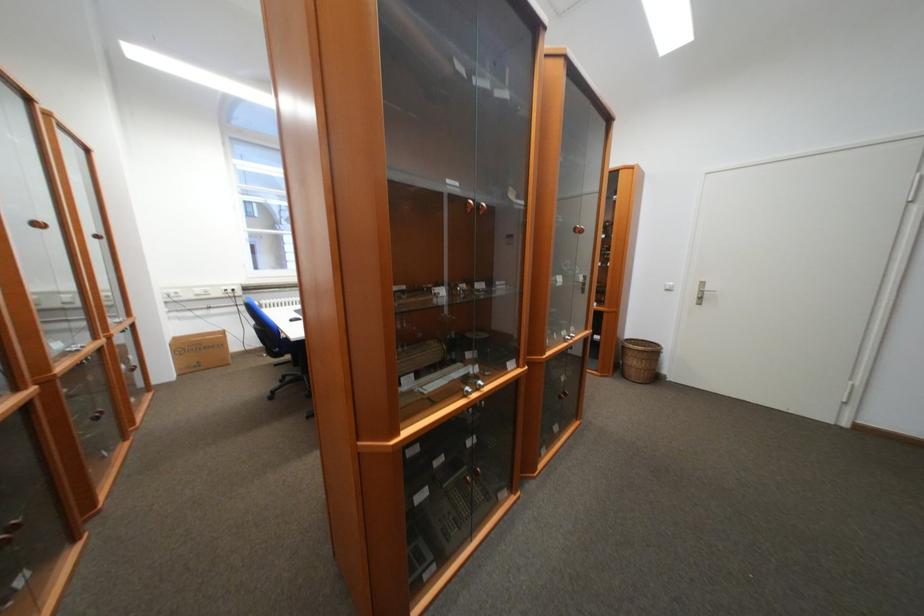
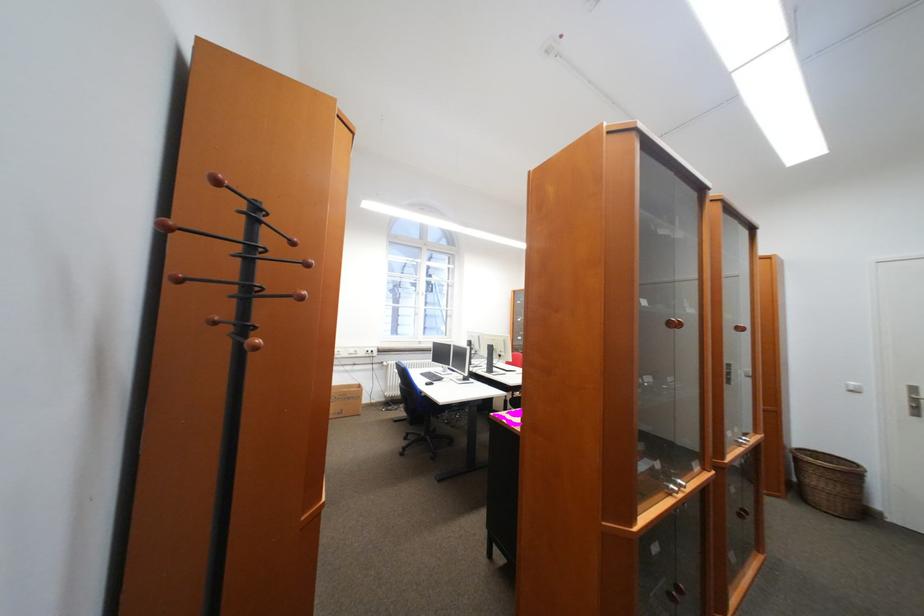
In the second image, find the point that corresponds to [290,382] in the first image.

(415, 439)